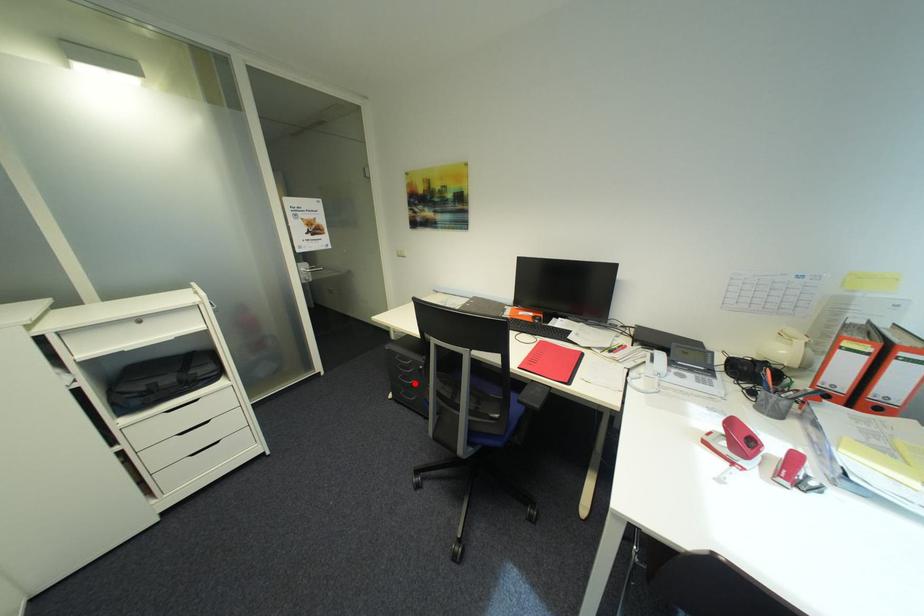
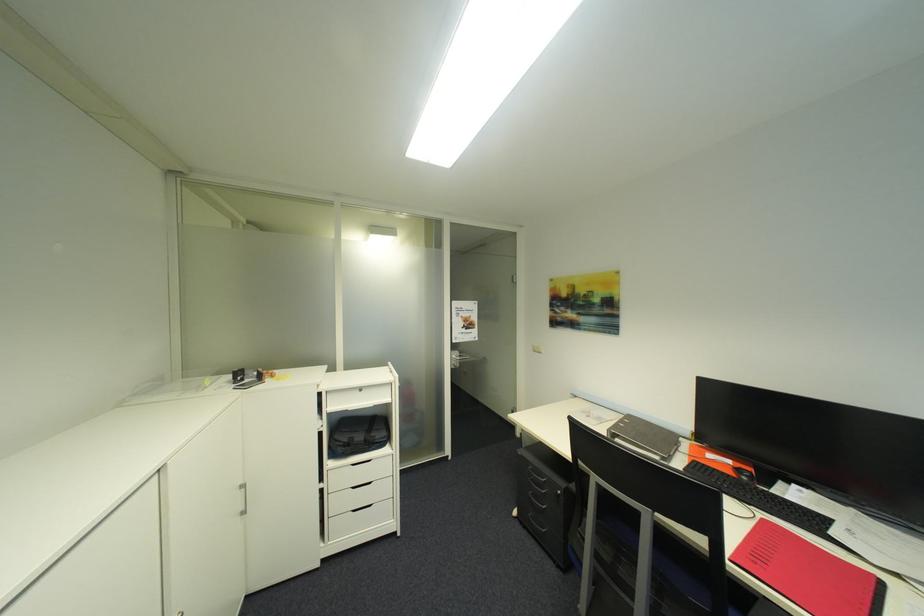
The point at the highlighted location is marked in the first image. Where is the corresponding point in the second image?

(544, 505)